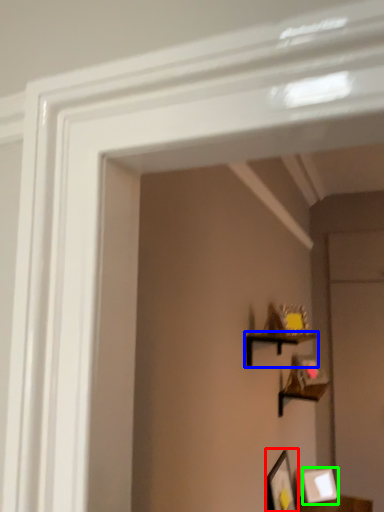
Question: Which object is positioned closest to picture frame (highlighted by a red box)? Select from shelf (highlighted by a blue box) and picture frame (highlighted by a green box).

Choices:
 (A) shelf
 (B) picture frame

Answer: (B)